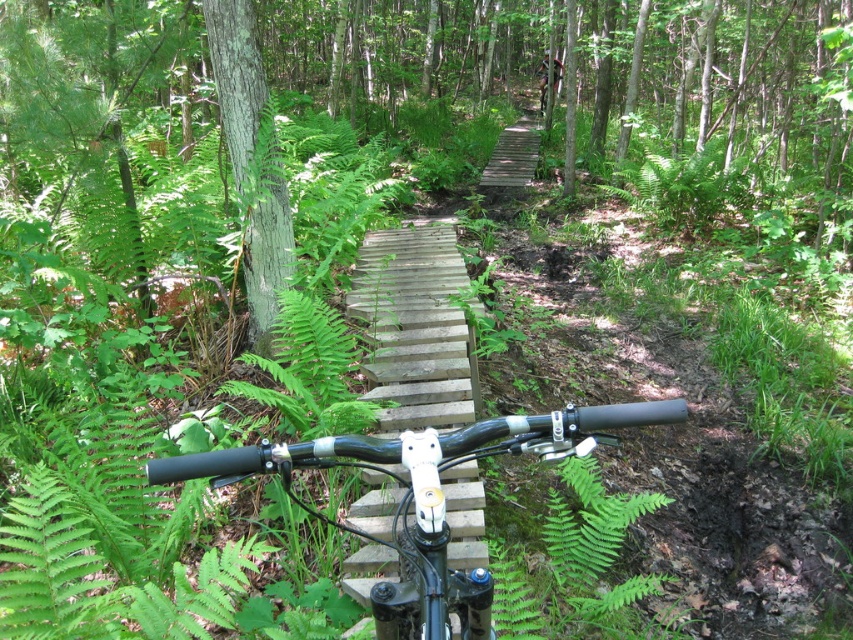
Question: Among these objects, which one is nearest to the camera?

Choices:
 (A) green rough bark tree at upper left
 (B) black matte handlebars at center
 (C) wooden bridge at center

Answer: (B)

Question: Is black matte handlebars at center to the right of wooden bridge at center from the viewer's perspective?

Choices:
 (A) yes
 (B) no

Answer: (A)

Question: Which of the following is the farthest from the observer?

Choices:
 (A) (490, 445)
 (B) (242, 35)

Answer: (B)

Question: Does black matte handlebars at center appear on the left side of green rough bark tree at upper left?

Choices:
 (A) no
 (B) yes

Answer: (A)

Question: Can you confirm if wooden bridge at center is positioned below green rough bark tree at upper left?

Choices:
 (A) yes
 (B) no

Answer: (A)

Question: Which object is the closest to the green rough bark tree at upper left?

Choices:
 (A) black matte handlebars at center
 (B) wooden bridge at center

Answer: (B)